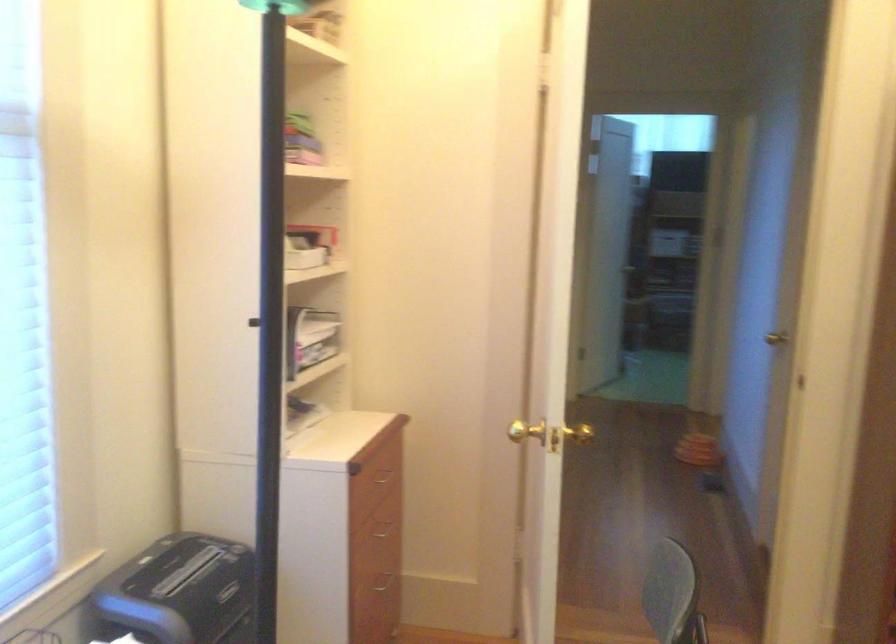
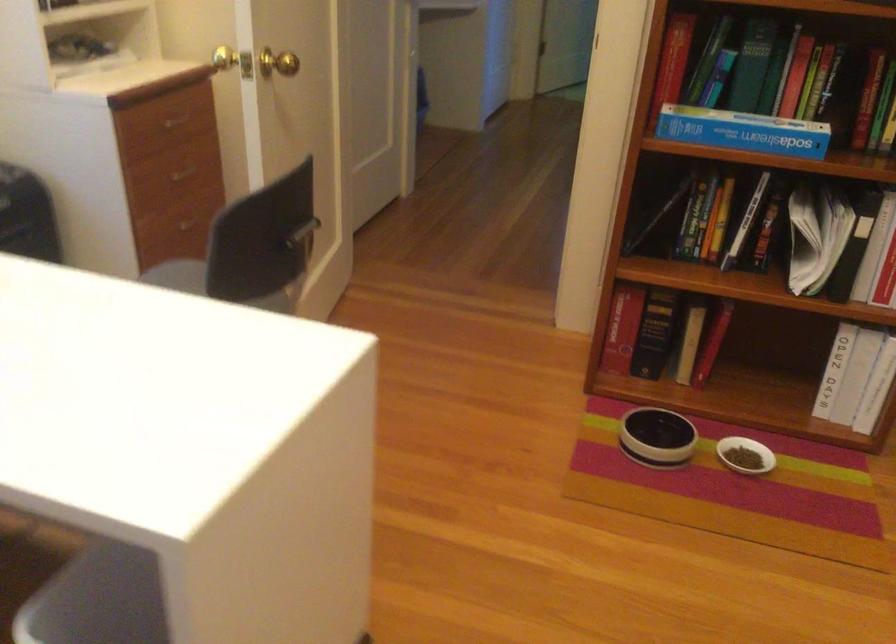
In the second image, find the point that corresponds to (x=386, y=478) in the first image.

(178, 122)